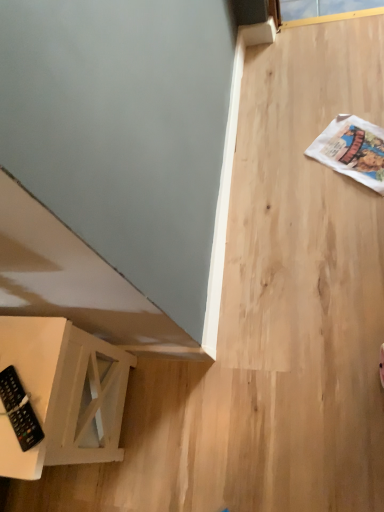
I want to click on free spot to the right of white wood side table at lower left, so click(183, 386).